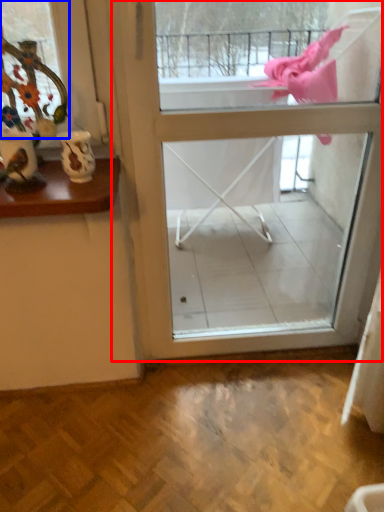
Question: Which object is further to the camera taking this photo, screen door (highlighted by a red box) or window (highlighted by a blue box)?

Choices:
 (A) screen door
 (B) window

Answer: (A)